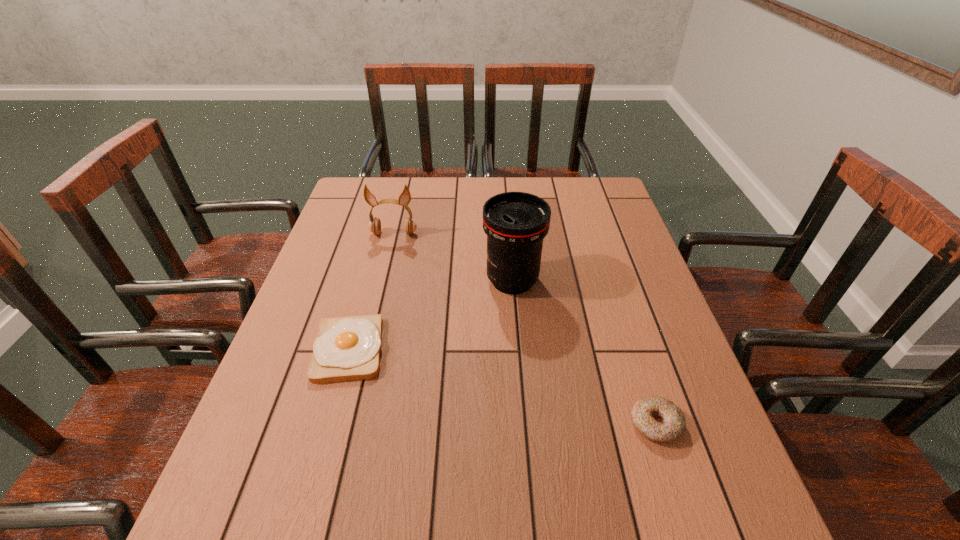
This screenshot has height=540, width=960. I want to click on empty space that is in between the second nearest object and the doughnut, so click(502, 387).

I want to click on free space between the doughnut and the telephoto lens, so click(584, 353).

Find the location of `free space that is in between the third farthest object and the doughnut`. free space that is in between the third farthest object and the doughnut is located at coordinates (502, 387).

I want to click on vacant space that's between the farthest object and the third nearest object, so click(453, 258).

Where is `vacant space that is in between the third shortest object and the second object from right to left`? vacant space that is in between the third shortest object and the second object from right to left is located at coordinates (453, 258).

Image resolution: width=960 pixels, height=540 pixels. What are the coordinates of `empty location between the second farthest object and the third farthest object` in the screenshot? It's located at (431, 315).

You are a GUI agent. You are given a task and a screenshot of the screen. Output one action in this format:
    pyautogui.click(x=<x>, y=<y>)
    Task: Click on the free space between the earphone and the telephoto lens
    This screenshot has height=540, width=960.
    Given the screenshot: What is the action you would take?
    pyautogui.click(x=453, y=258)

Locate an element on the screen. This screenshot has height=540, width=960. free space between the farthest object and the third farthest object is located at coordinates (372, 292).

This screenshot has width=960, height=540. What are the coordinates of `vacant region between the toast and the farthest object` in the screenshot? It's located at (372, 292).

At what (x,y) coordinates should I click in order to perform the action: click on object that can be found as the closest to the nearest object. Please return your answer as a coordinate pair (x, y). The image size is (960, 540). Looking at the image, I should click on (515, 223).